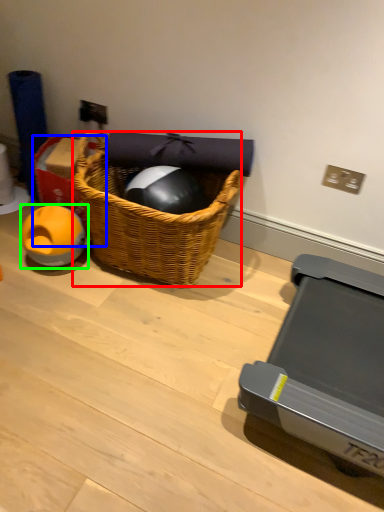
Question: Which object is positioned farthest from picnic basket (highlighted by a red box)? Select from box (highlighted by a blue box) and toy (highlighted by a green box).

Choices:
 (A) box
 (B) toy

Answer: (B)